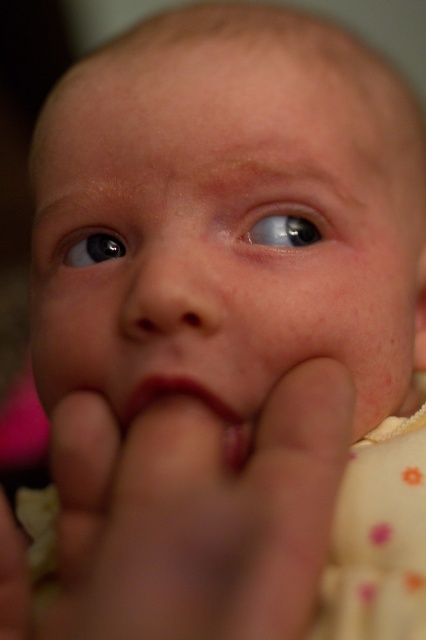
Question: Which point is farther to the camera?

Choices:
 (A) glossy blue eye at upper left
 (B) white dotted fabric at lower right
 (C) smooth skin baby face at center

Answer: (A)

Question: Does pink matte lips at center appear on the left side of white fabric bib at lower left?

Choices:
 (A) yes
 (B) no

Answer: (B)

Question: Does white dotted fabric at lower right come behind white fabric bib at lower left?

Choices:
 (A) yes
 (B) no

Answer: (B)

Question: Can you confirm if smooth skin baby face at center is positioned to the left of pink matte lips at center?

Choices:
 (A) no
 (B) yes

Answer: (A)

Question: Which of these objects is positioned closest to the white dotted fabric at lower right?

Choices:
 (A) glossy blue eye at upper left
 (B) blue glossy eye at upper right
 (C) white fabric bib at lower left

Answer: (B)

Question: Which object appears closest to the camera in this image?

Choices:
 (A) white dotted fabric at lower right
 (B) pink matte lips at center

Answer: (A)